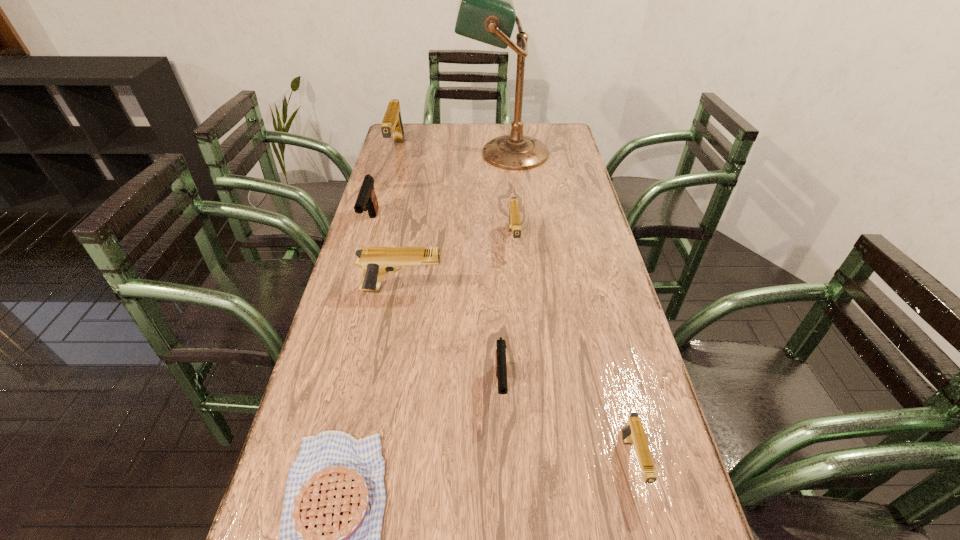
Identify the location of green table lamp. (x=486, y=13).

I want to click on table lamp, so click(486, 13).

Where is `the second tallest object`? This screenshot has height=540, width=960. the second tallest object is located at coordinates (392, 123).

What are the coordinates of `the biggest tan pistol` in the screenshot? It's located at (392, 123).

Image resolution: width=960 pixels, height=540 pixels. In order to click on the second biggest tan pistol in this screenshot , I will do `click(375, 261)`.

Locate an element on the screen. the second nearest tan pistol is located at coordinates (375, 261).

You are a GUI agent. You are given a task and a screenshot of the screen. Output one action in this format:
    pyautogui.click(x=<x>, y=<y>)
    Task: Click on the farther black pistol
    The width and height of the screenshot is (960, 540).
    Given the screenshot: What is the action you would take?
    pyautogui.click(x=366, y=200)

This screenshot has height=540, width=960. What are the coordinates of `the bigger black pistol` in the screenshot? It's located at (366, 200).

Identify the location of the third tan pistol from left to right. (514, 216).

This screenshot has height=540, width=960. What are the coordinates of `the fifth pistol from left to right` in the screenshot? It's located at 514,216.